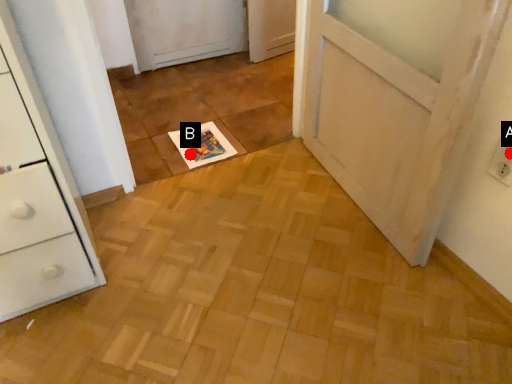
Question: Two points are circled on the image, labeled by A and B beside each circle. Which point is closer to the camera taking this photo?

Choices:
 (A) A is closer
 (B) B is closer

Answer: (A)